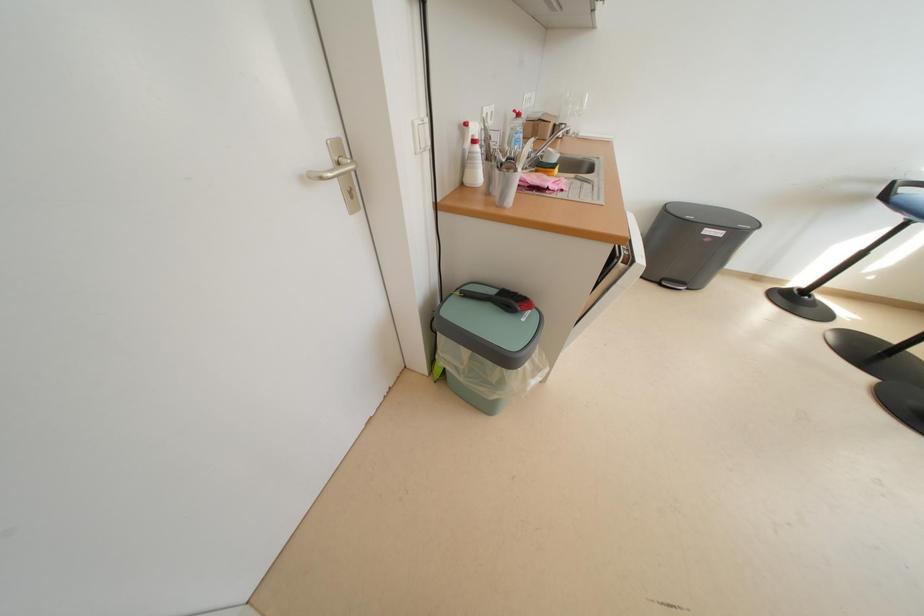
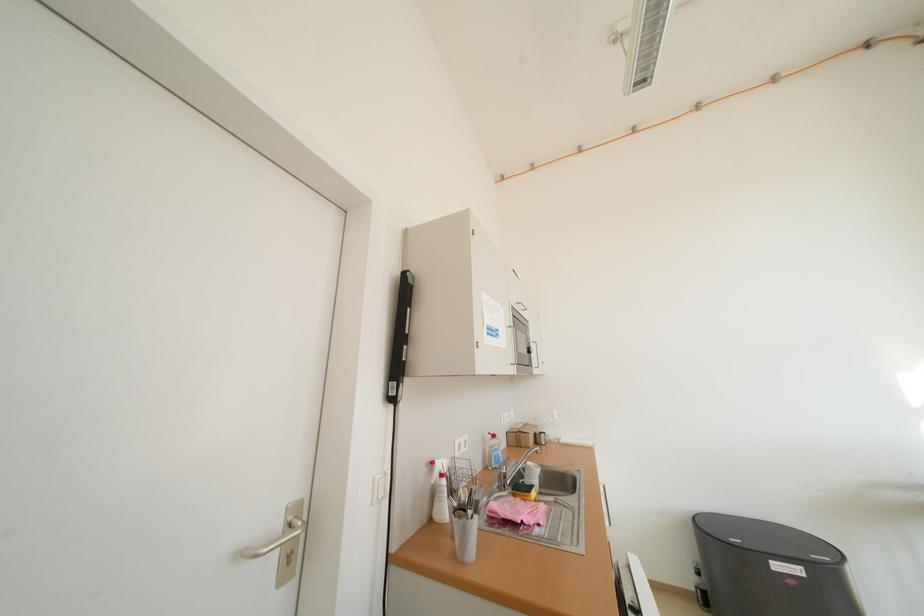
Question: The first image is from the beginning of the video and the second image is from the end. How did the camera likely rotate when shooting the video?

Choices:
 (A) Left
 (B) Right
 (C) Up
 (D) Down

Answer: (C)